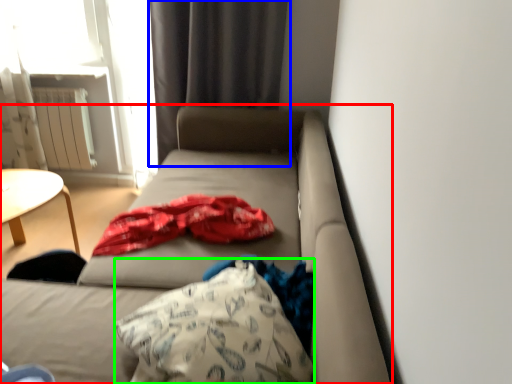
Question: Estimate the real-world distances between objects in this image. Which object is closer to studio couch (highlighted by a red box), curtain (highlighted by a blue box) or throw pillow (highlighted by a green box)?

Choices:
 (A) curtain
 (B) throw pillow

Answer: (B)